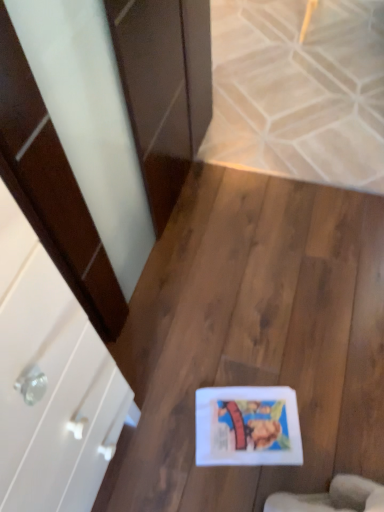
This screenshot has width=384, height=512. Describe the element at coordinates (52, 382) in the screenshot. I see `white glossy cabinet at left` at that location.

You are a GUI agent. You are given a task and a screenshot of the screen. Output one action in this format:
    pyautogui.click(x=<x>, y=<y>)
    Task: Click on the white glossy cabinet at left
    The height and width of the screenshot is (512, 384).
    Given the screenshot: What is the action you would take?
    click(x=52, y=382)

Locate an element on the screen. The image size is (384, 512). white glossy cabinet at left is located at coordinates (52, 382).